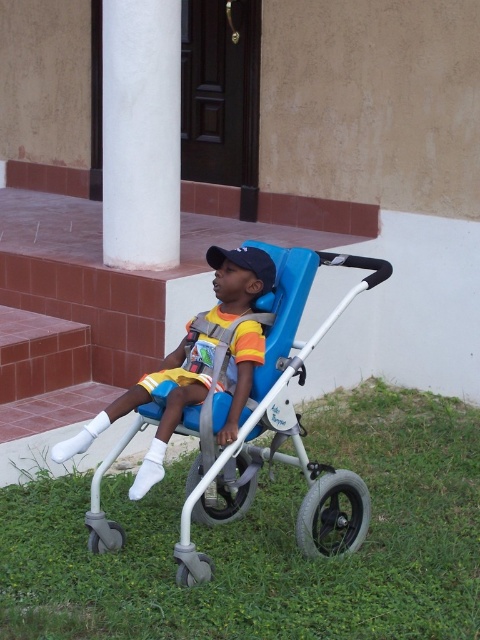
Question: Is white smooth column at upper left above blue matte baseball cap at center?

Choices:
 (A) no
 (B) yes

Answer: (B)

Question: Based on their relative distances, which object is farther from the blue plastic baby carriage at center?

Choices:
 (A) matte blue stroller at center
 (B) green grass at lower center
 (C) blue matte baseball cap at center
 (D) white smooth column at upper left

Answer: (D)

Question: Estimate the real-world distances between objects in this image. Which object is farther from the blue matte baseball cap at center?

Choices:
 (A) white smooth column at upper left
 (B) green grass at lower center
 (C) matte blue stroller at center

Answer: (B)

Question: Among these points, which one is farthest from the camera?

Choices:
 (A) (178, 204)
 (B) (249, 324)
 (C) (338, 449)
 (D) (301, 548)

Answer: (A)

Question: Does matte blue stroller at center have a smaller size compared to blue matte baseball cap at center?

Choices:
 (A) yes
 (B) no

Answer: (B)

Question: Does white smooth column at upper left appear on the right side of blue matte baseball cap at center?

Choices:
 (A) no
 (B) yes

Answer: (A)